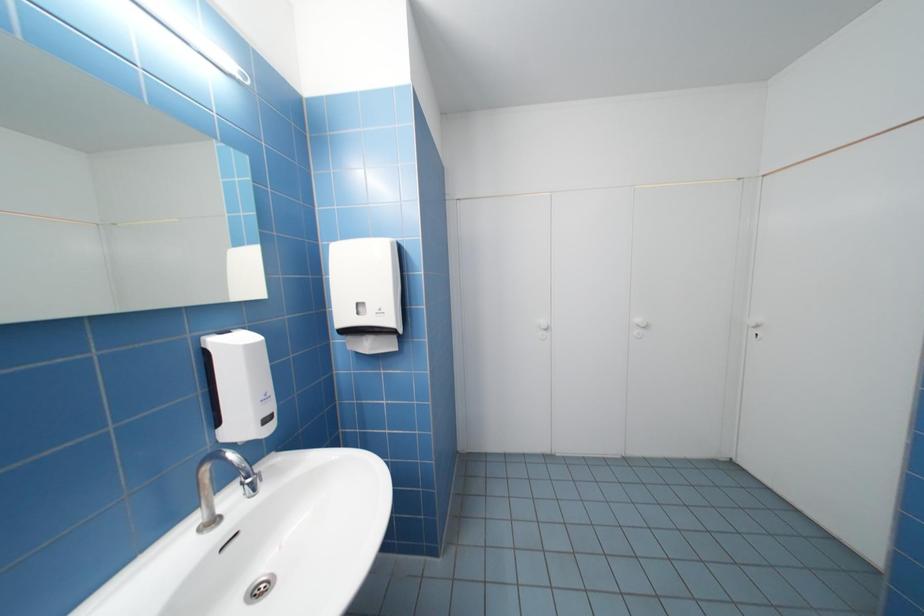
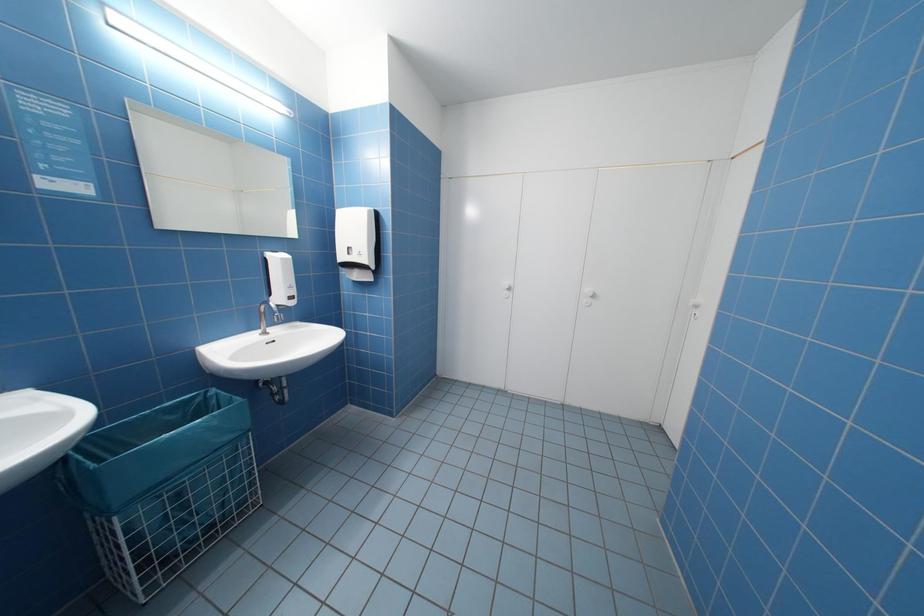
The images are taken continuously from a first-person perspective. In which direction are you moving?

The cameraman moved toward right, backward.